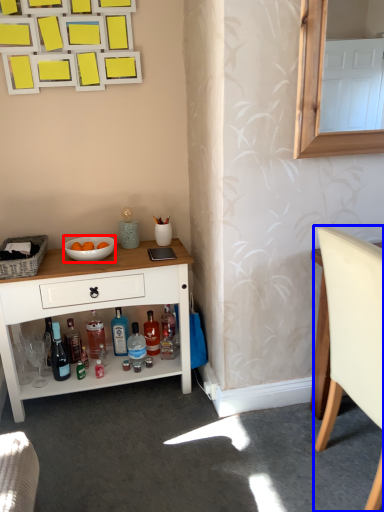
Question: Which point is further to the camera, bowl (highlighted by a red box) or chair (highlighted by a blue box)?

Choices:
 (A) bowl
 (B) chair

Answer: (A)